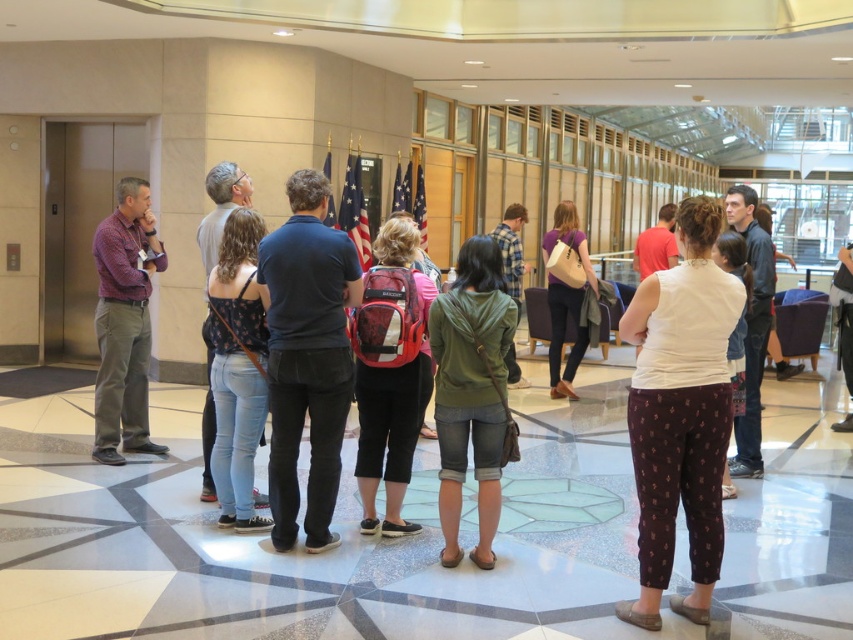
You are standing in the room and want to hand a document to the person wearing the dark blue cotton shirt at center and the red backpack at center. Which one can you reach first without moving closer?

The dark blue cotton shirt at center is closer to the viewer than the red backpack at center, so you can reach the person wearing the dark blue cotton shirt at center first without moving closer.